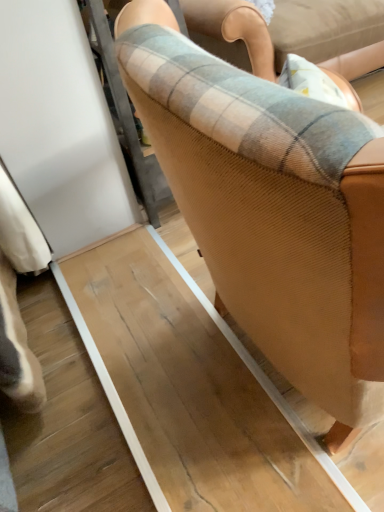
Question: Does point (336, 179) appear closer or farther from the camera than point (256, 66)?

Choices:
 (A) closer
 (B) farther

Answer: (A)

Question: Based on their sizes in the image, would you say plaid fabric at center is bigger or smaller than brown textured chair at center?

Choices:
 (A) big
 (B) small

Answer: (A)

Question: Is plaid fabric at center in front of or behind brown textured chair at center in the image?

Choices:
 (A) front
 (B) behind

Answer: (B)

Question: From a real-world perspective, relative to plaid fabric at center, is brown textured chair at center vertically above or below?

Choices:
 (A) above
 (B) below

Answer: (A)

Question: Is brown textured chair at center to the left or to the right of plaid fabric at center in the image?

Choices:
 (A) right
 (B) left

Answer: (B)

Question: Is brown textured chair at center in front of or behind plaid fabric at center in the image?

Choices:
 (A) behind
 (B) front

Answer: (B)

Question: Considering the positions of brown textured chair at center and plaid fabric at center in the image, is brown textured chair at center wider or thinner than plaid fabric at center?

Choices:
 (A) wide
 (B) thin

Answer: (B)